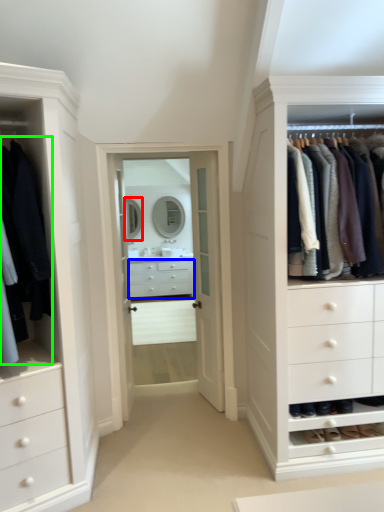
Question: Estimate the real-world distances between objects in this image. Which object is farther from mirror (highlighted by a red box), drawer (highlighted by a blue box) or clothing (highlighted by a green box)?

Choices:
 (A) drawer
 (B) clothing

Answer: (B)